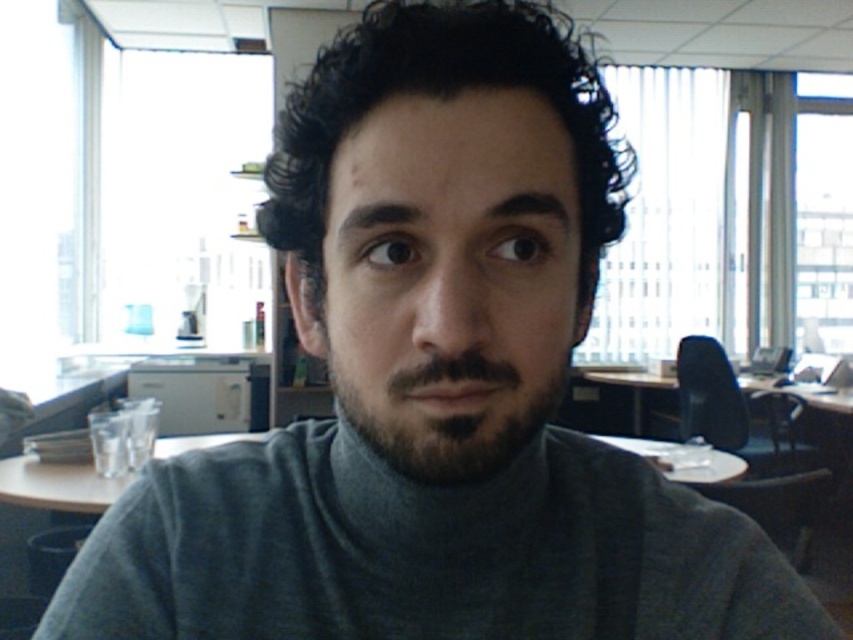
Can you confirm if gray turtleneck sweater at center is taller than dark brown fuzzy beard at center?

Yes.

Who is more distant from viewer, (x=97, y=596) or (x=462, y=442)?

Positioned behind is point (x=97, y=596).

Is point (322, 561) in front of point (488, 381)?

No, it is behind (488, 381).

Identify the location of gray turtleneck sweater at center. (422, 552).